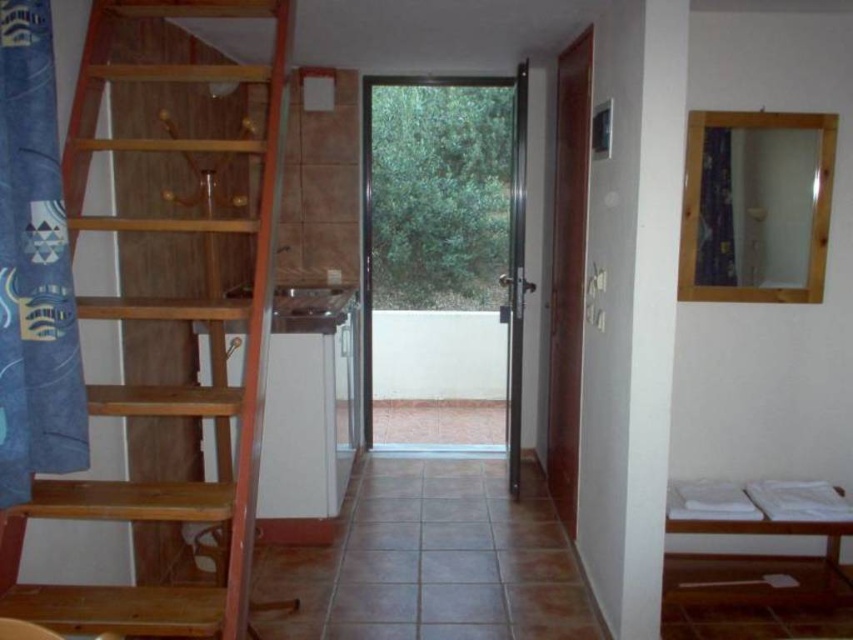
Question: From the image, what is the correct spatial relationship of wooden ladder at left in relation to white wooden bunk bed at lower right?

Choices:
 (A) right
 (B) left

Answer: (B)

Question: Is wooden ladder at left positioned in front of white wooden bunk bed at lower right?

Choices:
 (A) no
 (B) yes

Answer: (B)

Question: Can you confirm if wooden ladder at left is wider than white wooden bunk bed at lower right?

Choices:
 (A) yes
 (B) no

Answer: (B)

Question: Among these objects, which one is nearest to the camera?

Choices:
 (A) wooden ladder at left
 (B) white wooden bunk bed at lower right

Answer: (A)